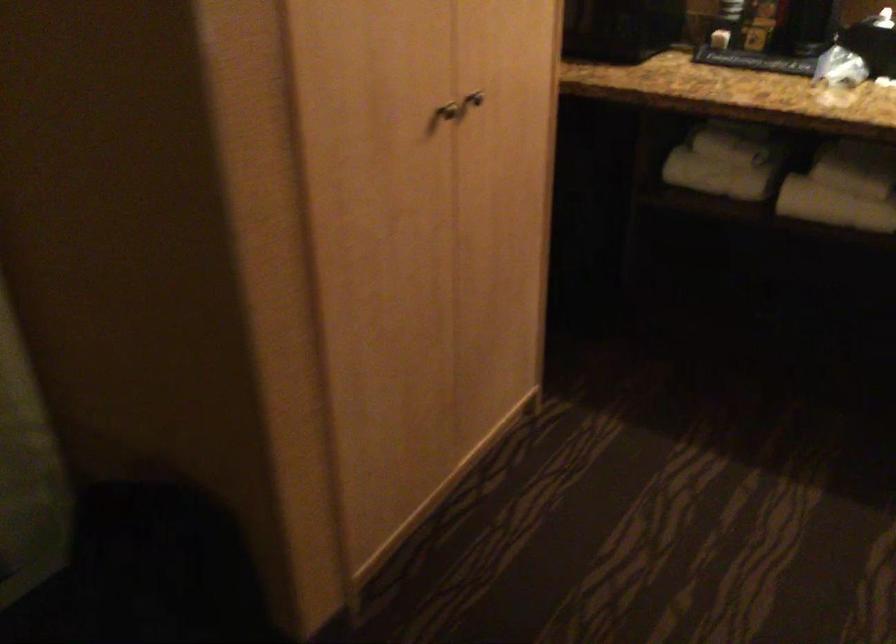
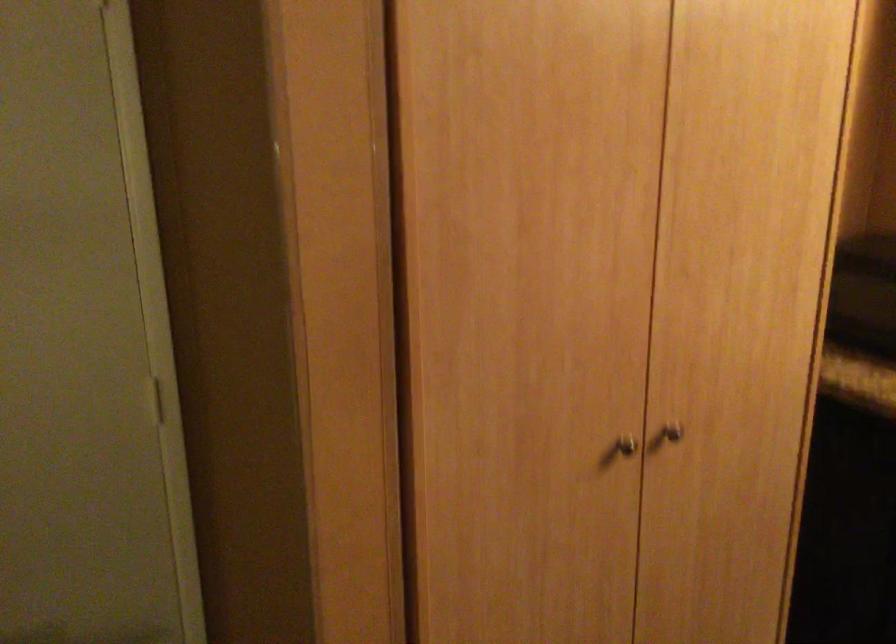
Locate, in the second image, the point that corresponds to (436,102) in the first image.

(625, 444)